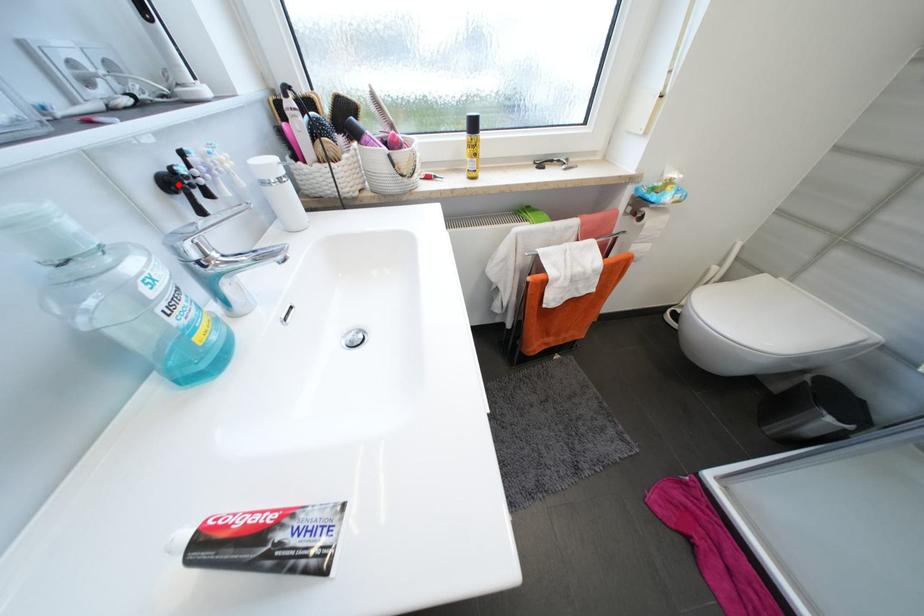
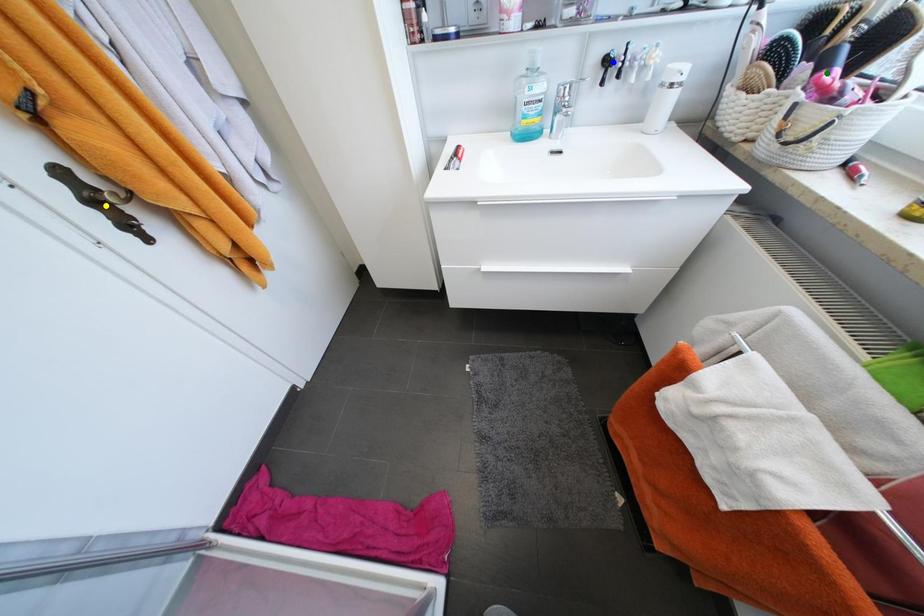
Question: I am providing you with two images of the same scene from different viewpoints. A red point is marked on the first image. You are given multiple points on the second image. In image 2, which mark is for the same physical point as the one in image 1?

Choices:
 (A) blue point
 (B) yellow point
 (C) green point

Answer: (A)